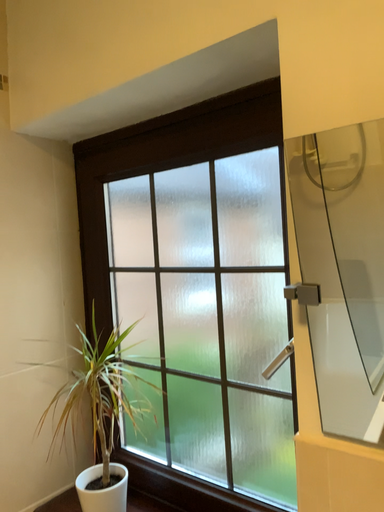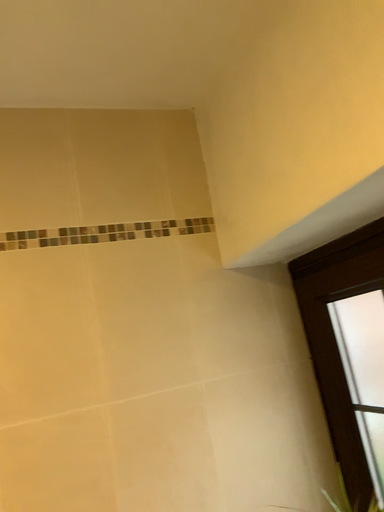
Question: Which way did the camera rotate in the video?

Choices:
 (A) rotated right
 (B) rotated left

Answer: (B)